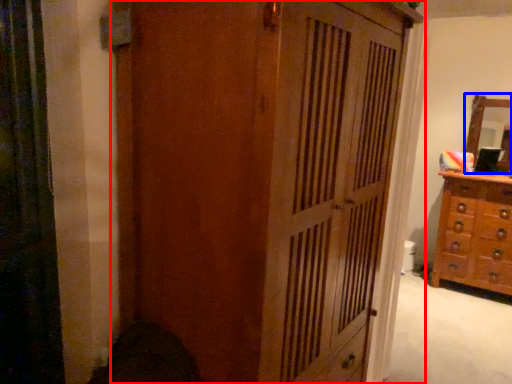
Question: Among these objects, which one is farthest to the camera, cupboard (highlighted by a red box) or mirror (highlighted by a blue box)?

Choices:
 (A) cupboard
 (B) mirror

Answer: (B)